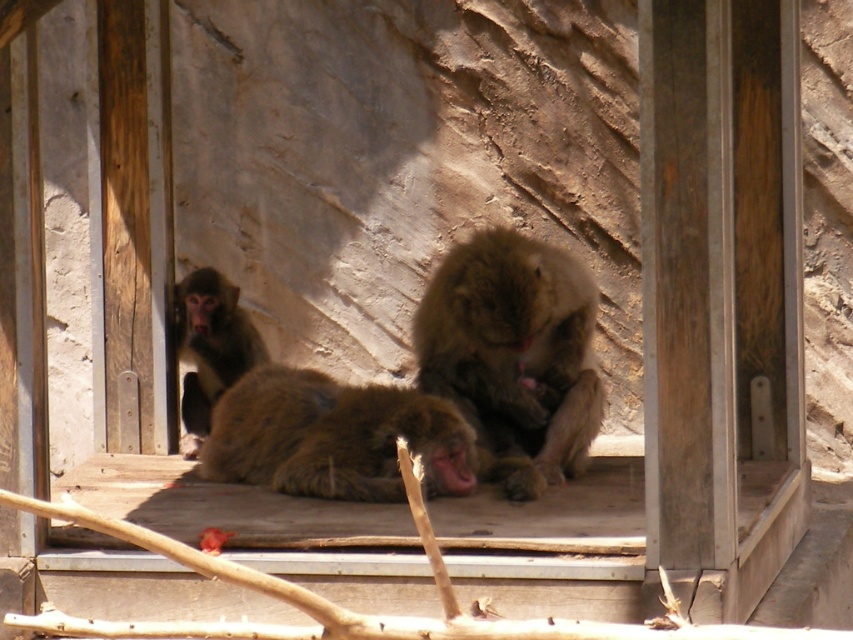
Question: Which of the following is the farthest from the observer?

Choices:
 (A) (358, 387)
 (B) (229, 376)
 (C) (506, 308)

Answer: (A)

Question: Which of the following is the farthest from the observer?

Choices:
 (A) brown furry monkey at center
 (B) fuzzy brown monkey at center

Answer: (A)

Question: Can you confirm if brown furry monkey at center is smaller than fuzzy brown monkey at center?

Choices:
 (A) yes
 (B) no

Answer: (B)

Question: Which point appears closest to the camera in this image?

Choices:
 (A) pos(291,477)
 (B) pos(554,404)
 (C) pos(233,323)

Answer: (A)

Question: Considering the relative positions of brown furry monkey at center and fuzzy brown monkey at center in the image provided, where is brown furry monkey at center located with respect to fuzzy brown monkey at center?

Choices:
 (A) below
 (B) above

Answer: (B)

Question: Is brown furry monkey at center further to the viewer compared to fuzzy brown monkey at center?

Choices:
 (A) no
 (B) yes

Answer: (B)